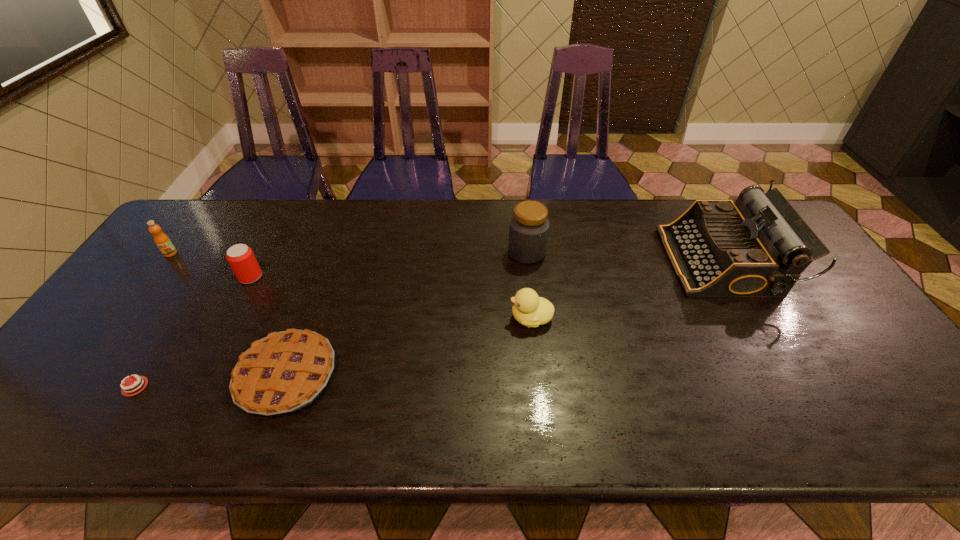
Find the location of a particular element. The height and width of the screenshot is (540, 960). vacant space located 0.350m on the keyboard of the typewriter is located at coordinates (x=551, y=261).

Image resolution: width=960 pixels, height=540 pixels. I want to click on vacant space located 0.250m on the keyboard of the typewriter, so click(585, 261).

The height and width of the screenshot is (540, 960). Find the location of `free space located on the surface of the jar near the warning symbol`. free space located on the surface of the jar near the warning symbol is located at coordinates pyautogui.click(x=445, y=253).

Locate an element on the screen. This screenshot has width=960, height=540. free space located on the surface of the jar near the warning symbol is located at coordinates (413, 253).

Identify the location of free space located on the surface of the jar near the warning symbol. This screenshot has width=960, height=540. (400, 253).

This screenshot has height=540, width=960. In order to click on vacant space situated 0.340m on the front label of the leftmost object in this screenshot , I will do `click(99, 350)`.

Identify the location of free space located 0.400m on the front of the third object from left to right. (179, 416).

At what (x,y) coordinates should I click in order to perform the action: click on free space located 0.350m at the beak of the duckling. Please return your answer as a coordinate pair (x, y). This screenshot has width=960, height=540. Looking at the image, I should click on (376, 318).

This screenshot has height=540, width=960. In order to click on vacant space located at the beak of the duckling in this screenshot , I will do `click(479, 318)`.

Locate an element on the screen. This screenshot has height=540, width=960. vacant region located at the beak of the duckling is located at coordinates (403, 318).